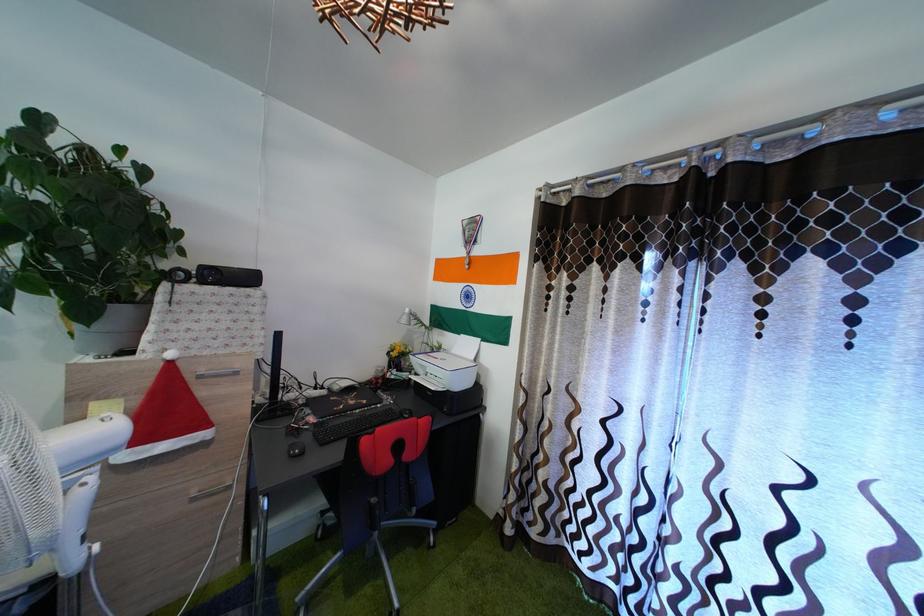
At what (x,y) coordinates should I click in order to perform the action: click on black computer mouse. Please return your answer as a coordinate pair (x, y). Looking at the image, I should click on (296, 448).